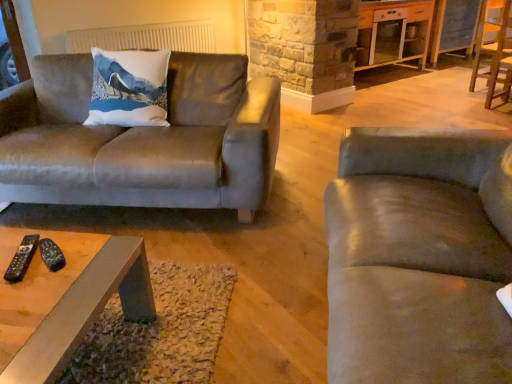
Question: From the image's perspective, is white fabric radiator at upper center positioned above or below black plastic remote at lower left, the first remote when ordered from left to right?

Choices:
 (A) above
 (B) below

Answer: (A)

Question: Is white fabric radiator at upper center taller or shorter than black plastic remote at lower left, the first remote when ordered from left to right?

Choices:
 (A) short
 (B) tall

Answer: (B)

Question: Which object is positioned closest to the white fabric radiator at upper center?

Choices:
 (A) black plastic remote at lower left, placed as the second remote when sorted from left to right
 (B) suede couch at left, the second studio couch when ordered from front to back
 (C) white glossy cabinet at upper right
 (D) wooden chair at right
 (E) suede-like gray couch at right, arranged as the 1th studio couch when viewed from the right

Answer: (B)

Question: Which is farther from the metallic gray coffee table at center?

Choices:
 (A) black plastic remote at lower left, positioned as the second remote in right-to-left order
 (B) black plastic remote at lower left, which is the first remote from right to left
 (C) suede-like gray couch at right, which is counted as the 2th studio couch, starting from the left
 (D) white fabric radiator at upper center
 (E) suede couch at left, the second studio couch when ordered from front to back

Answer: (D)